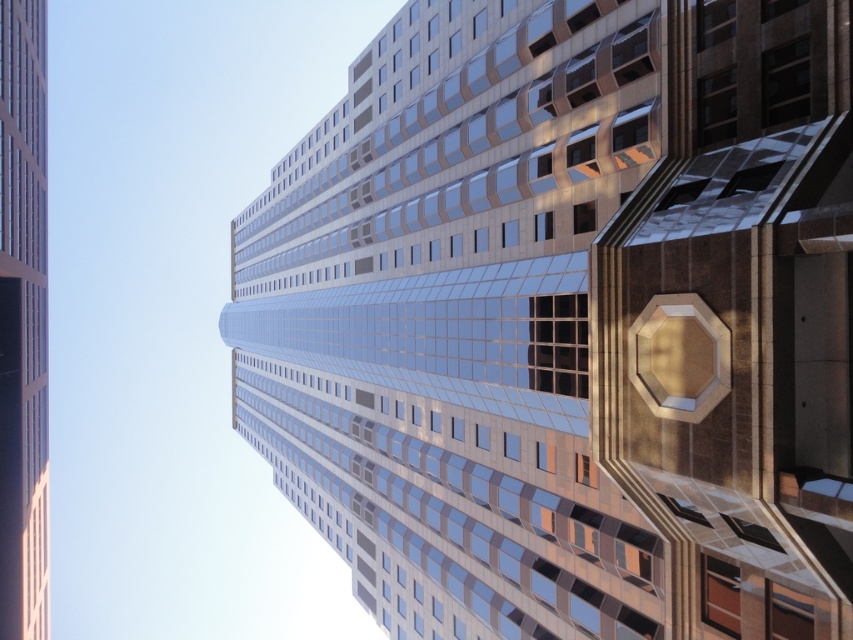
You are standing at the base of the skyscraper and notice two points marked on the building. The first point is located at coordinates point (x=775, y=42), and the second is at point (x=35, y=300). Which of these points is closer to your current position?

Point (x=775, y=42) is in front of point (x=35, y=300), so the point closer to your current position is point (x=775, y=42).

You are standing at the base of the skyscraper and want to take a photo of the glossy glass tower at center and the glassy reflective skyscraper at center. Which one is more to the right?

The glossy glass tower at center is positioned on the right side of glassy reflective skyscraper at center, so it is more to the right.